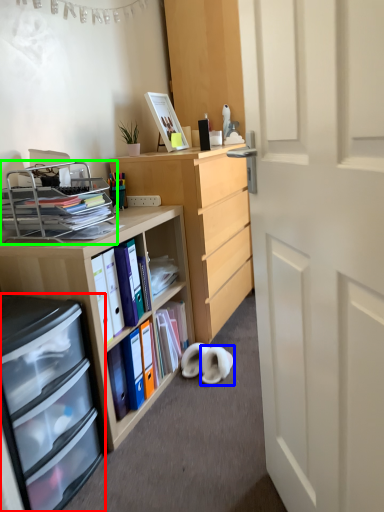
Question: Estimate the real-world distances between objects in this image. Which object is farther from cabinetry (highlighted by a red box), footwear (highlighted by a blue box) or shelf (highlighted by a green box)?

Choices:
 (A) footwear
 (B) shelf

Answer: (A)